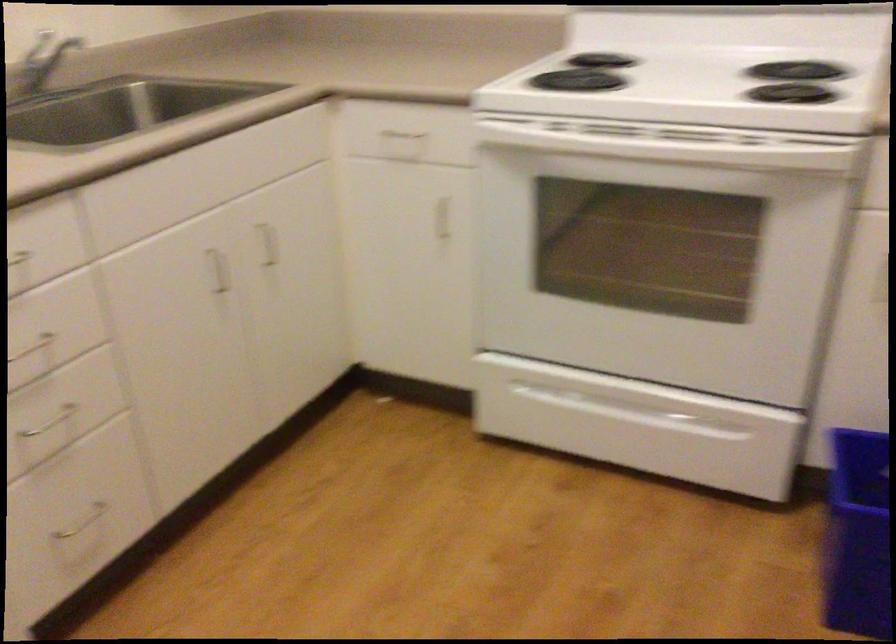
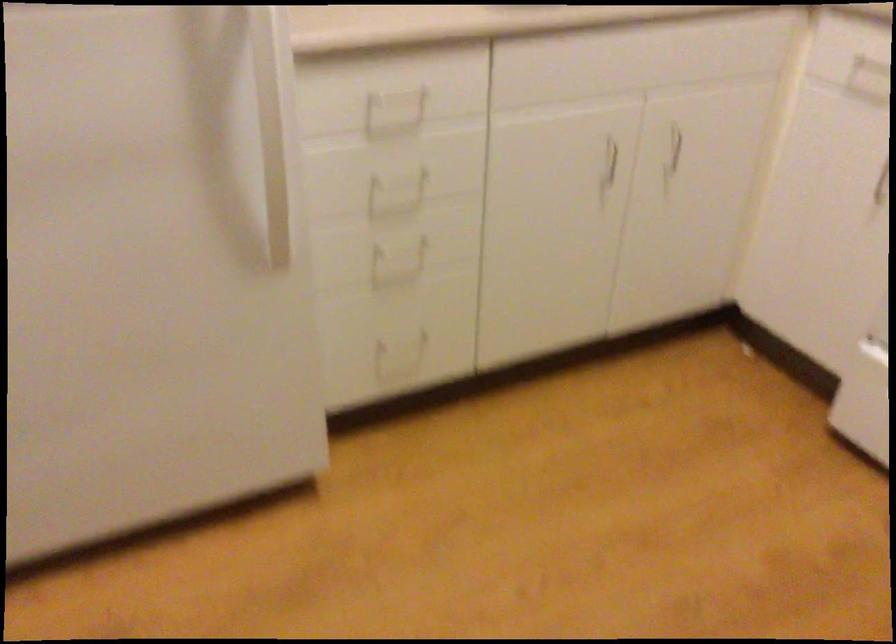
In the second image, find the point that corresponds to (80,526) in the first image.

(401, 345)